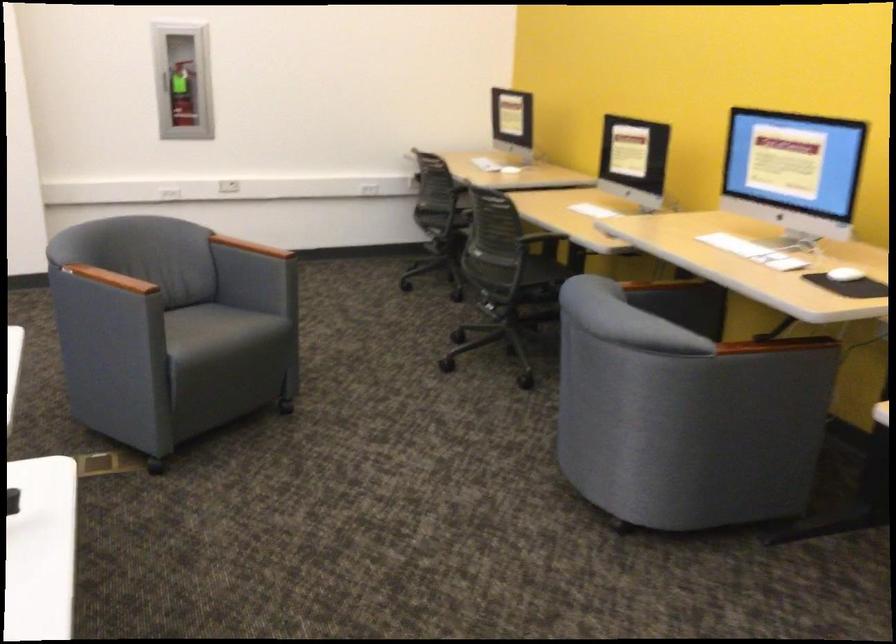
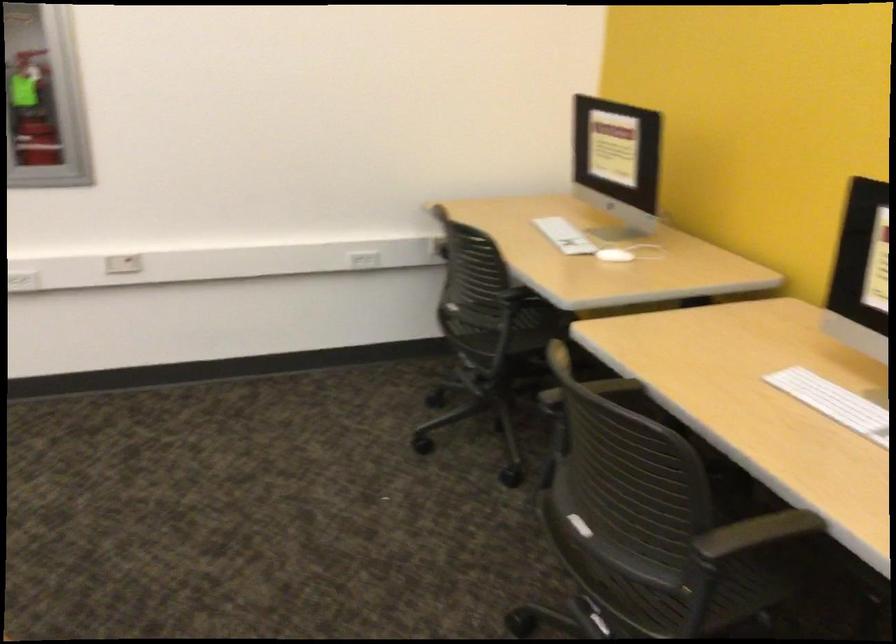
Question: Which direction would the cameraman need to move to produce the second image? Reply with the corresponding letter.

Choices:
 (A) Left
 (B) Right
 (C) Forward
 (D) Backward

Answer: (C)